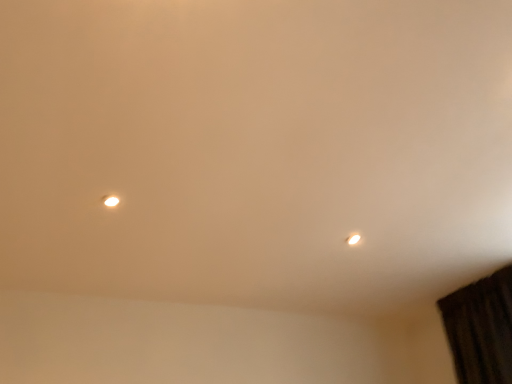
You are a GUI agent. You are given a task and a screenshot of the screen. Output one action in this format:
    pyautogui.click(x=<x>, y=<y>)
    Task: Click on the matte white lamp at upper left
    Image resolution: width=512 pixels, height=384 pixels.
    Given the screenshot: What is the action you would take?
    pyautogui.click(x=111, y=201)

What do you see at coordinates (111, 201) in the screenshot? I see `matte white lamp at upper left` at bounding box center [111, 201].

Locate an element on the screen. The height and width of the screenshot is (384, 512). matte white lamp at upper left is located at coordinates (111, 201).